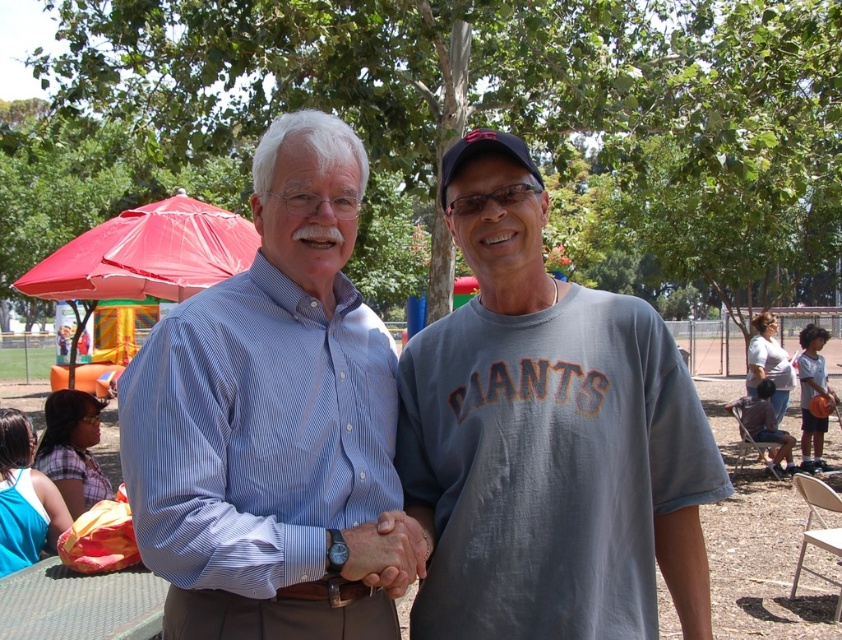
Does red plastic umbrella at upper left appear on the left side of green plastic picnic table at lower left?

Indeed, red plastic umbrella at upper left is positioned on the left side of green plastic picnic table at lower left.

Between point (93, 276) and point (88, 614), which one is positioned behind?

Positioned behind is point (93, 276).

The image size is (842, 640). What do you see at coordinates (147, 253) in the screenshot? I see `red plastic umbrella at upper left` at bounding box center [147, 253].

Image resolution: width=842 pixels, height=640 pixels. In order to click on red plastic umbrella at upper left in this screenshot , I will do `click(147, 253)`.

Which is behind, point (686, 561) or point (782, 384)?

The point (782, 384) is behind.

Does point (545, 221) come behind point (758, 356)?

That is False.

Locate an element on the screen. gray cotton t-shirt at center is located at coordinates (546, 436).

Between point (475, 262) and point (112, 221), which one is positioned in front?

Point (475, 262) is more forward.

Is gray cotton t-shirt at center bigger than red plastic umbrella at upper left?

No, gray cotton t-shirt at center is not bigger than red plastic umbrella at upper left.

Between point (670, 484) and point (216, 227), which one is positioned in front?

Point (670, 484)

In order to click on gray cotton t-shirt at center in this screenshot , I will do `click(546, 436)`.